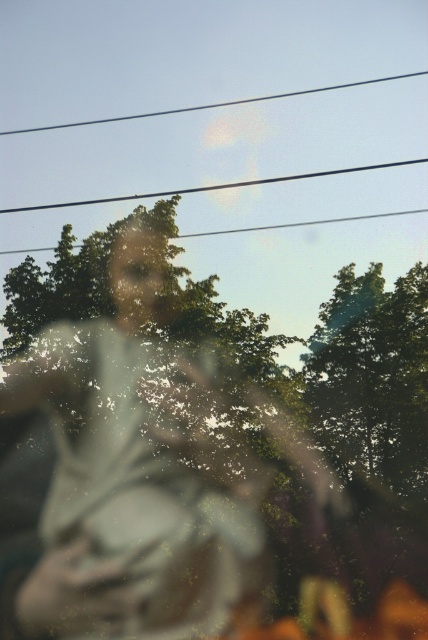
Question: Does clear wire at upper center appear on the left side of smooth wire at upper center?

Choices:
 (A) no
 (B) yes

Answer: (A)

Question: Which of the following is the closest to the observer?

Choices:
 (A) (23, 208)
 (B) (98, 429)
 (C) (86, 122)

Answer: (B)

Question: Based on their relative distances, which object is farther from the smooth wire at upper center?

Choices:
 (A) translucent glass figure at center
 (B) clear wire at upper center

Answer: (A)

Question: Can you confirm if translucent glass figure at center is thinner than clear wire at upper center?

Choices:
 (A) no
 (B) yes

Answer: (B)

Question: Does clear wire at upper center come in front of smooth wire at upper center?

Choices:
 (A) yes
 (B) no

Answer: (A)

Question: Which object appears farthest from the camera in this image?

Choices:
 (A) clear wire at upper center
 (B) translucent glass figure at center

Answer: (A)